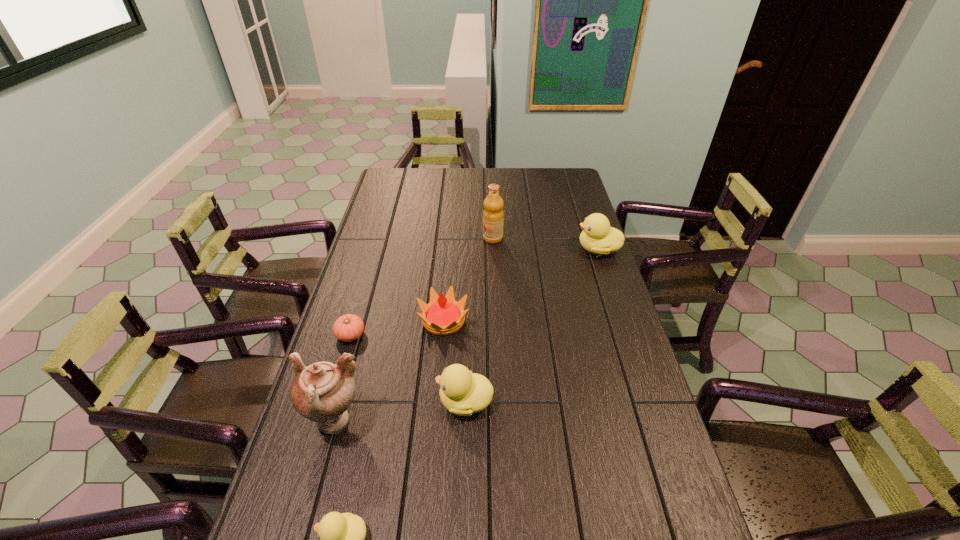
Please point a space for a new duckling to maintain equal intervals. Please provide its 2D coordinates. Your answer should be formatted as a tuple, i.e. [(x, y)], where the tuple contains the x and y coordinates of a point satisfying the conditions above.

[(543, 312)]